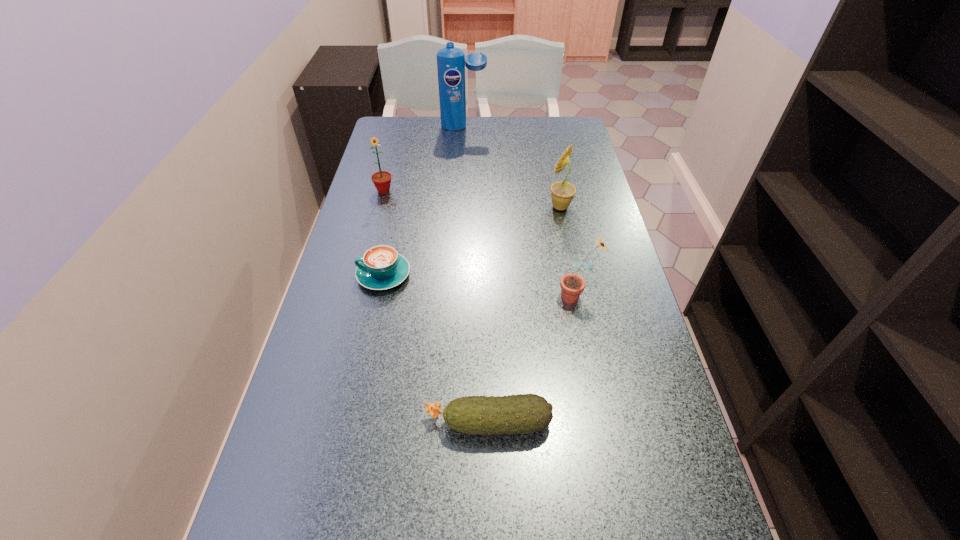
Identify the location of free point between the nearest sunflower and the cappuccino. The image size is (960, 540). (480, 286).

In order to click on empty space between the third farthest object and the farthest object in this screenshot , I will do `click(512, 167)`.

You are a GUI agent. You are given a task and a screenshot of the screen. Output one action in this format:
    pyautogui.click(x=<x>, y=<y>)
    Task: Click on the vacant region between the nearest object and the leftmost sunflower
    The image size is (960, 540).
    Given the screenshot: What is the action you would take?
    pyautogui.click(x=436, y=307)

Identify the location of vacant space that is in between the fourth nearest object and the leftmost sunflower. (472, 199).

I want to click on vacant space that's between the nearest object and the second farthest sunflower, so click(524, 315).

Locate an element on the screen. The width and height of the screenshot is (960, 540). object that stands as the fifth closest to the nearest sunflower is located at coordinates (451, 61).

Select which object appears as the closest to the nearest sunflower. Please provide its 2D coordinates. Your answer should be formatted as a tuple, i.e. [(x, y)], where the tuple contains the x and y coordinates of a point satisfying the conditions above.

[(525, 413)]

Where is `sunflower that is the second closest one to the nearest object`? This screenshot has height=540, width=960. sunflower that is the second closest one to the nearest object is located at coordinates (562, 193).

In order to click on sunflower identified as the third closest to the farthest object in this screenshot , I will do `click(572, 285)`.